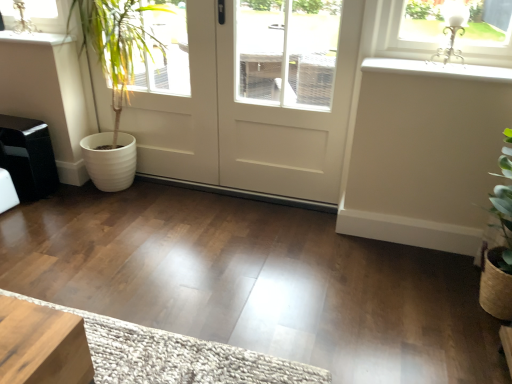
Where is `empty space that is ontop of white textured doormat at lower center (from a real-world perspective)`? empty space that is ontop of white textured doormat at lower center (from a real-world perspective) is located at coordinates (166, 357).